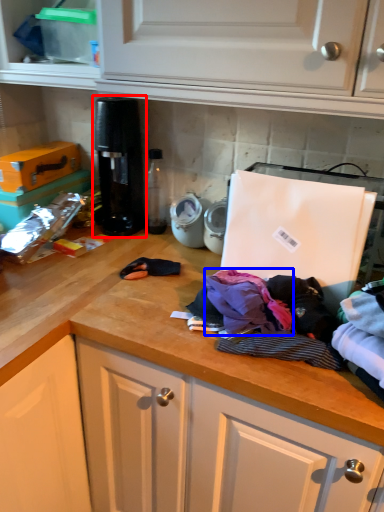
Question: Which object is further to the camera taking this photo, coffee machine (highlighted by a red box) or clothing (highlighted by a blue box)?

Choices:
 (A) coffee machine
 (B) clothing

Answer: (A)